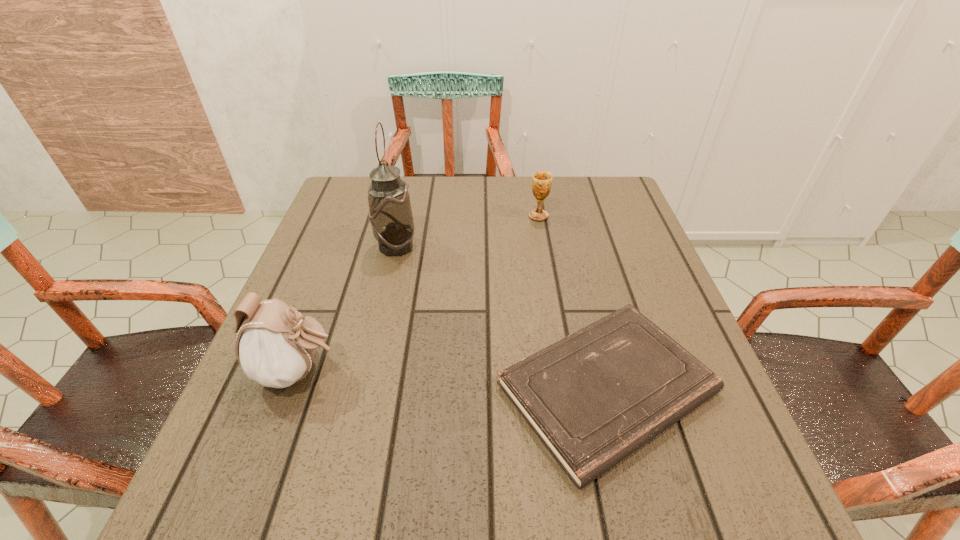
I want to click on object at the far edge, so click(x=541, y=184).

This screenshot has width=960, height=540. Find the location of `object present at the near edge`. object present at the near edge is located at coordinates (594, 397).

Find the location of a particular element. The width and height of the screenshot is (960, 540). oil lamp situated at the left edge is located at coordinates (390, 215).

This screenshot has width=960, height=540. Identify the location of pouch located in the left edge section of the desktop. (275, 347).

Locate an element on the screen. object present at the right edge is located at coordinates (594, 397).

At what (x,y) coordinates should I click in order to perform the action: click on object located in the near right corner section of the desktop. Please return your answer as a coordinate pair (x, y). The height and width of the screenshot is (540, 960). Looking at the image, I should click on (x=594, y=397).

Locate an element on the screen. This screenshot has height=540, width=960. vacant space at the far edge of the desktop is located at coordinates (521, 183).

This screenshot has height=540, width=960. In order to click on blank space at the left edge of the desktop in this screenshot , I will do `click(306, 290)`.

In the image, there is a desktop. Where is `vacant space at the right edge`? Image resolution: width=960 pixels, height=540 pixels. vacant space at the right edge is located at coordinates (686, 452).

In the image, there is a desktop. Where is `vacant area at the far left corner`? This screenshot has width=960, height=540. vacant area at the far left corner is located at coordinates (335, 215).